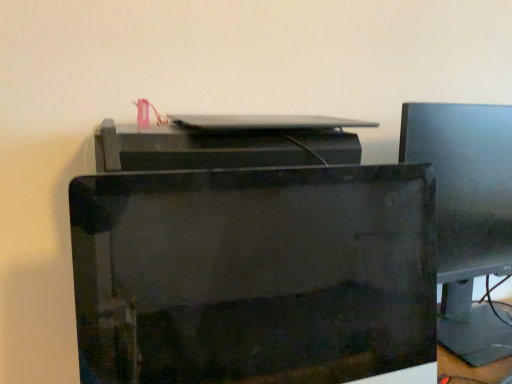
The height and width of the screenshot is (384, 512). What do you see at coordinates (250, 259) in the screenshot? I see `glossy black printer at center` at bounding box center [250, 259].

Where is `matte black monitor at right`? matte black monitor at right is located at coordinates (467, 215).

This screenshot has height=384, width=512. Identify the location of computer monitor below the satin silver laptop at center (from the image's perspective). (467, 215).

Is point (481, 214) closer to viewer compared to point (196, 124)?

No, (481, 214) is behind (196, 124).

Is matte black monitor at right looking in the opposite direction of satin silver laptop at center?

matte black monitor at right is not turned away from satin silver laptop at center.

From a real-world perspective, is matte black monitor at right physically located above or below satin silver laptop at center?

In terms of real-world spatial position, matte black monitor at right is below satin silver laptop at center.

Considering the relative positions of matte black monitor at right and glossy black printer at center in the image provided, is matte black monitor at right to the left of glossy black printer at center from the viewer's perspective?

In fact, matte black monitor at right is to the right of glossy black printer at center.

Considering the points (478, 137) and (205, 163), which point is behind, point (478, 137) or point (205, 163)?

The point (478, 137) is behind.

Does matte black monitor at right have a greater width compared to glossy black printer at center?

Correct, the width of matte black monitor at right exceeds that of glossy black printer at center.

From a real-world perspective, relative to glossy black printer at center, is satin silver laptop at center vertically above or below?

Clearly, from a real-world perspective, satin silver laptop at center is above glossy black printer at center.

Is point (300, 124) closer to camera compared to point (252, 220)?

Yes, point (300, 124) is closer to viewer.

From the image's perspective, is satin silver laptop at center positioned above or below glossy black printer at center?

From the image's perspective, satin silver laptop at center appears above glossy black printer at center.

The height and width of the screenshot is (384, 512). I want to click on desktop above the glossy black printer at center (from the image's perspective), so click(x=265, y=122).

In the scene shown: Is glossy black printer at center next to satin silver laptop at center and touching it?

glossy black printer at center is not next to satin silver laptop at center, and they're not touching.

Which object is further away from the camera taking this photo, glossy black printer at center or satin silver laptop at center?

satin silver laptop at center is more distant.

Is point (144, 213) closer to camera compared to point (258, 129)?

Yes, it is.

Considering the sizes of objects glossy black printer at center and satin silver laptop at center in the image provided, who is shorter, glossy black printer at center or satin silver laptop at center?

With less height is satin silver laptop at center.

Based on their positions, is satin silver laptop at center located to the left or right of matte black monitor at right?

Clearly, satin silver laptop at center is on the left of matte black monitor at right in the image.

Can you confirm if satin silver laptop at center is thinner than matte black monitor at right?

Yes, satin silver laptop at center is thinner than matte black monitor at right.

Would you say satin silver laptop at center is outside matte black monitor at right?

Indeed, satin silver laptop at center is completely outside matte black monitor at right.

Is glossy black printer at center positioned beyond the bounds of matte black monitor at right?

Indeed, glossy black printer at center is completely outside matte black monitor at right.

Which object is closer to the camera, glossy black printer at center or matte black monitor at right?

Positioned in front is glossy black printer at center.

Would you say glossy black printer at center is a long distance from matte black monitor at right?

glossy black printer at center is actually quite close to matte black monitor at right.

Between point (205, 269) and point (441, 332), which one is positioned in front?

The point (441, 332) is more forward.

Identify the location of desktop above the matte black monitor at right (from a real-world perspective). (265, 122).

In order to click on printer on the left of matte black monitor at right in this screenshot , I will do `click(250, 259)`.

Based on their spatial positions, is glossy black printer at center or satin silver laptop at center closer to matte black monitor at right?

satin silver laptop at center is positioned closer to the anchor matte black monitor at right.

Estimate the real-world distances between objects in this image. Which object is further from satin silver laptop at center, glossy black printer at center or matte black monitor at right?

matte black monitor at right is positioned further to the anchor satin silver laptop at center.

From the image, which object appears to be farther from glossy black printer at center, satin silver laptop at center or matte black monitor at right?

matte black monitor at right is further to glossy black printer at center.

Looking at the image, which one is located closer to matte black monitor at right, satin silver laptop at center or glossy black printer at center?

The object closer to matte black monitor at right is satin silver laptop at center.

Looking at the image, which one is located further to glossy black printer at center, matte black monitor at right or satin silver laptop at center?

Based on the image, matte black monitor at right appears to be further to glossy black printer at center.

When comparing their distances from satin silver laptop at center, does matte black monitor at right or glossy black printer at center seem closer?

glossy black printer at center is closer to satin silver laptop at center.

Locate an element on the screen. The width and height of the screenshot is (512, 384). printer located between satin silver laptop at center and matte black monitor at right in the left-right direction is located at coordinates (250, 259).